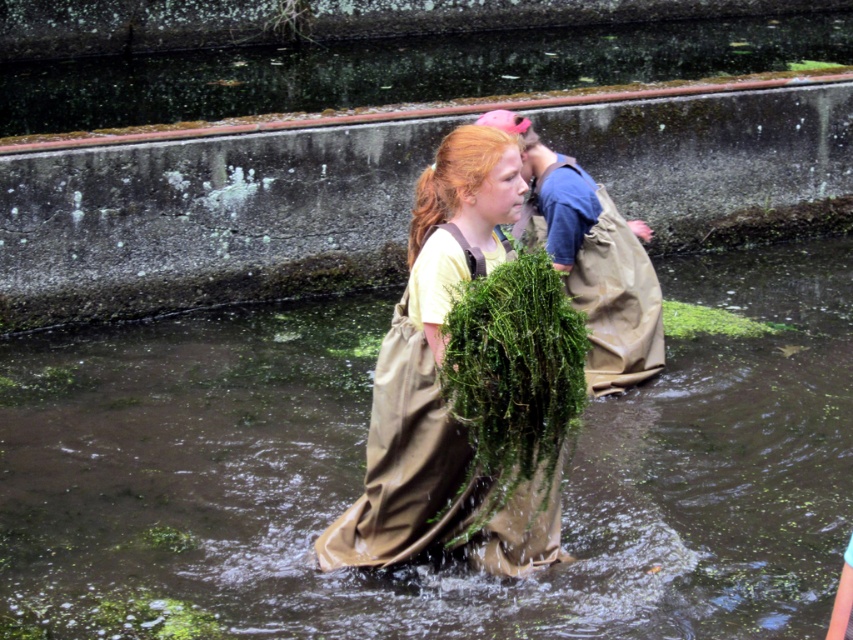
Question: Does matte brown bag at center appear under green leafy plant at center?

Choices:
 (A) yes
 (B) no

Answer: (A)

Question: Which point is closer to the camera?

Choices:
 (A) green mossy bundle at center
 (B) green leafy algae at center
 (C) green mossy fabric at center

Answer: (B)

Question: Where is green mossy bundle at center located in relation to green leafy algae at center in the image?

Choices:
 (A) below
 (B) above

Answer: (A)

Question: Which point is farther from the camera taking this photo?

Choices:
 (A) (601, 358)
 (B) (236, 326)
 (C) (689, 307)

Answer: (C)

Question: Which object is positioned closest to the green mossy bundle at center?

Choices:
 (A) green mossy fabric at center
 (B) green leafy algae at center
 (C) green leafy plant at center
 (D) matte brown bag at center

Answer: (A)

Question: Where is matte brown bag at center located in relation to green mossy fabric at center in the image?

Choices:
 (A) right
 (B) left

Answer: (B)